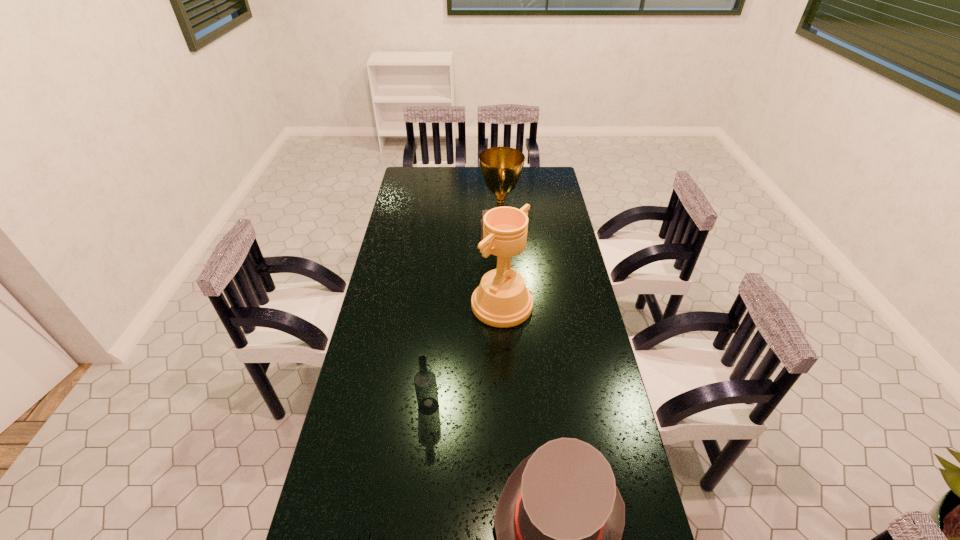
Find the location of a particular element. The height and width of the screenshot is (540, 960). the nearer award is located at coordinates (502, 300).

I want to click on the farthest object, so click(x=501, y=167).

You are a GUI agent. You are given a task and a screenshot of the screen. Output one action in this format:
    pyautogui.click(x=<x>, y=<y>)
    Task: Click on the third farthest object
    This screenshot has height=540, width=960.
    Given the screenshot: What is the action you would take?
    pyautogui.click(x=425, y=383)

Find the location of `vodka`. vodka is located at coordinates (425, 383).

You are a GUI agent. You are given a task and a screenshot of the screen. Output one action in this format:
    pyautogui.click(x=<x>, y=<y>)
    Task: Click on the free space located on the front of the nearer award
    
    Given the screenshot: What is the action you would take?
    pyautogui.click(x=509, y=432)

Identify the location of free region located on the plaque of the farthest object. Image resolution: width=960 pixels, height=540 pixels. (398, 232).

Locate an element on the screen. This screenshot has height=540, width=960. free space located 0.220m on the plaque of the farthest object is located at coordinates (430, 232).

Where is `blank area located 0.220m on the plaque of the farthest object`? The image size is (960, 540). blank area located 0.220m on the plaque of the farthest object is located at coordinates (430, 232).

The image size is (960, 540). I want to click on free space located 0.050m on the front of the vodka, so click(x=426, y=431).

Image resolution: width=960 pixels, height=540 pixels. What are the coordinates of `vacant space at the far edge` in the screenshot? It's located at (472, 188).